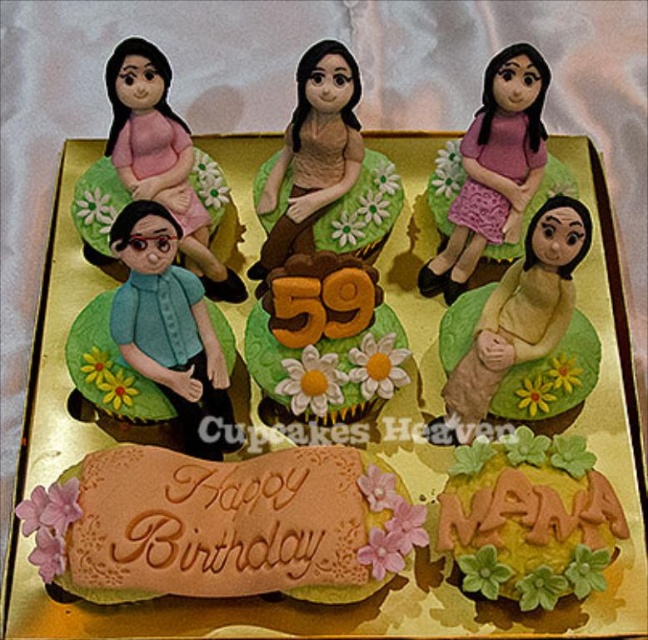
Question: Can you confirm if yellow fondant cake at lower right is positioned below brown fondant number at center?

Choices:
 (A) yes
 (B) no

Answer: (A)

Question: Which point is closer to the camera taking this photo?

Choices:
 (A) (463, 147)
 (B) (380, 390)

Answer: (B)

Question: Which object is farther from the camera taking this photo?

Choices:
 (A) yellow matte figurine at center
 (B) matte brown doll at center
 (C) yellow fondant cake at lower right
 (D) pink fabric doll at upper center

Answer: (B)

Question: Does brown fondant number at center appear on the left side of matte pink fabric doll at upper left?

Choices:
 (A) no
 (B) yes

Answer: (A)

Question: Which of the following is the closest to the observer?

Choices:
 (A) (297, 280)
 (B) (314, 227)
 (C) (518, 272)
 (D) (548, 563)

Answer: (D)

Question: Does brown fondant number at center appear over matte brown doll at center?

Choices:
 (A) yes
 (B) no

Answer: (B)